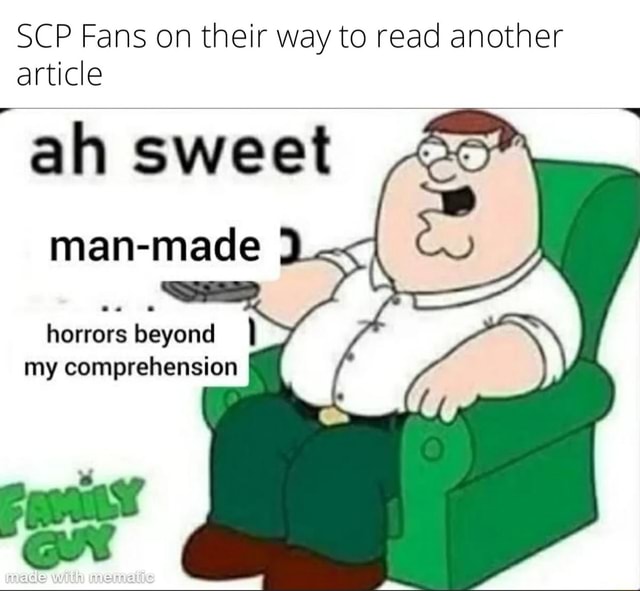
The height and width of the screenshot is (591, 640). I want to click on armrests, so click(x=477, y=441), click(x=278, y=374).